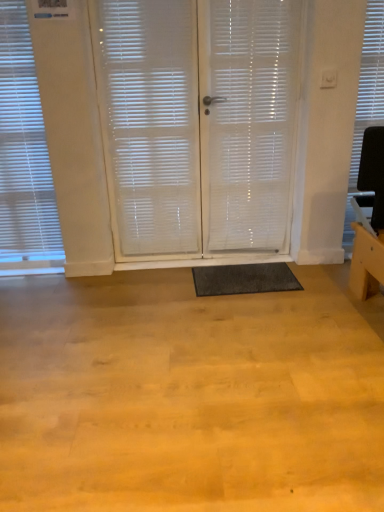
Question: Does white translucent curtain at center have a greater width compared to white translucent screen door at center, the 1th screen door viewed from the right?

Choices:
 (A) no
 (B) yes

Answer: (A)

Question: Is white translucent curtain at center positioned in front of white translucent screen door at center, the 1th screen door viewed from the right?

Choices:
 (A) no
 (B) yes

Answer: (B)

Question: Is white translucent curtain at center beside white translucent screen door at center, the 1th screen door viewed from the right?

Choices:
 (A) yes
 (B) no

Answer: (B)

Question: From the image's perspective, is white translucent curtain at center under white translucent screen door at center, which is the 2th screen door in left-to-right order?

Choices:
 (A) no
 (B) yes

Answer: (B)

Question: From a real-world perspective, is white translucent curtain at center over white translucent screen door at center, the 1th screen door viewed from the right?

Choices:
 (A) no
 (B) yes

Answer: (B)

Question: Can we say white translucent curtain at center lies outside white translucent screen door at center, which is the 2th screen door in left-to-right order?

Choices:
 (A) no
 (B) yes

Answer: (B)

Question: Is white textured blind at upper right, positioned as the 1th window blind in right-to-left order, shorter than white translucent blinds at left, the second window blind when ordered from right to left?

Choices:
 (A) no
 (B) yes

Answer: (B)

Question: Is white textured blind at upper right, positioned as the 1th window blind in right-to-left order, taller than white translucent blinds at left, which is counted as the first window blind, starting from the left?

Choices:
 (A) no
 (B) yes

Answer: (A)

Question: Is white textured blind at upper right, acting as the second window blind starting from the left, located outside white translucent blinds at left, which is counted as the first window blind, starting from the left?

Choices:
 (A) yes
 (B) no

Answer: (A)

Question: Is white textured blind at upper right, positioned as the 1th window blind in right-to-left order, turned away from white translucent blinds at left, which is counted as the first window blind, starting from the left?

Choices:
 (A) no
 (B) yes

Answer: (A)

Question: From a real-world perspective, is white textured blind at upper right, positioned as the 1th window blind in right-to-left order, under white translucent blinds at left, the second window blind when ordered from right to left?

Choices:
 (A) no
 (B) yes

Answer: (A)

Question: Considering the relative sizes of white textured blind at upper right, acting as the second window blind starting from the left, and white translucent blinds at left, the second window blind when ordered from right to left, in the image provided, is white textured blind at upper right, acting as the second window blind starting from the left, smaller than white translucent blinds at left, the second window blind when ordered from right to left,?

Choices:
 (A) yes
 (B) no

Answer: (A)

Question: Is there a large distance between white translucent blinds at left, the second window blind when ordered from right to left, and dark gray rubber mat at center?

Choices:
 (A) no
 (B) yes

Answer: (B)